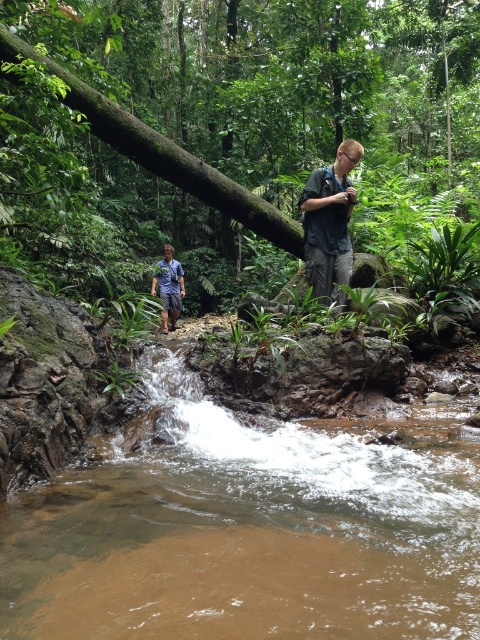
Question: Which point is farther from the camera taking this photo?

Choices:
 (A) (344, 204)
 (B) (275, 208)
 (C) (215, 588)
 (D) (165, 314)

Answer: (D)

Question: Can you confirm if green rough tree trunk at upper center is positioned above blue shirt at center?

Choices:
 (A) yes
 (B) no

Answer: (A)

Question: Does brown muddy stream at lower center have a greater width compared to light brown fabric shirt at center?

Choices:
 (A) no
 (B) yes

Answer: (B)

Question: From the image, what is the correct spatial relationship of brown muddy stream at lower center in relation to green rough tree trunk at upper center?

Choices:
 (A) right
 (B) left

Answer: (A)

Question: Among these objects, which one is nearest to the camera?

Choices:
 (A) brown muddy stream at lower center
 (B) blue shirt at center
 (C) green rough tree trunk at upper center
 (D) light brown fabric shirt at center

Answer: (A)

Question: Which point is farther to the camera?

Choices:
 (A) brown muddy stream at lower center
 (B) green rough log at upper center
 (C) green rough tree trunk at upper center

Answer: (C)